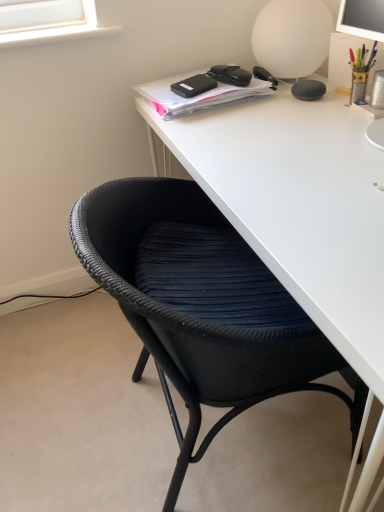
At what (x,y) coordinates should I click in order to perform the action: click on vacant area situated to the left side of black woven chair at lower left. Please return your answer as a coordinate pair (x, y). This screenshot has height=512, width=384. Looking at the image, I should click on (66, 406).